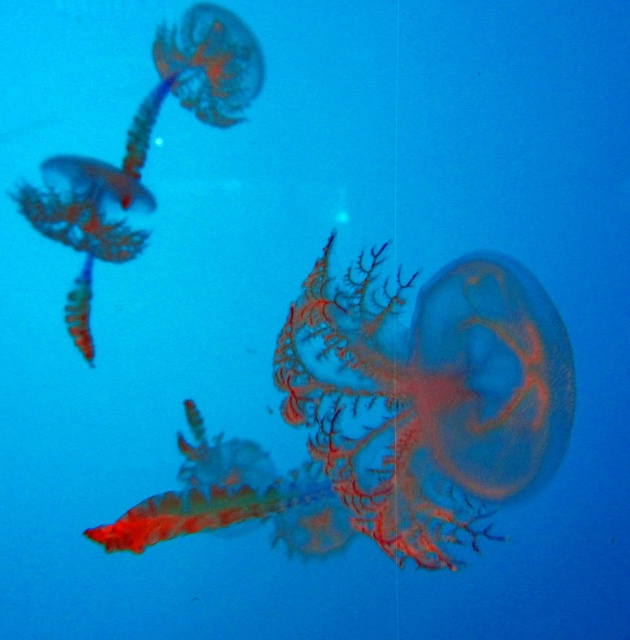
Can you confirm if translucent orange jellyfish at center is wider than translucent gelatinous at left?

Yes, translucent orange jellyfish at center is wider than translucent gelatinous at left.

Can you confirm if translucent orange jellyfish at center is taller than translucent gelatinous at left?

In fact, translucent orange jellyfish at center may be shorter than translucent gelatinous at left.

What do you see at coordinates (387, 417) in the screenshot? I see `translucent orange jellyfish at center` at bounding box center [387, 417].

At what (x,y) coordinates should I click in order to perform the action: click on translucent orange jellyfish at center. Please return your answer as a coordinate pair (x, y). Looking at the image, I should click on (387, 417).